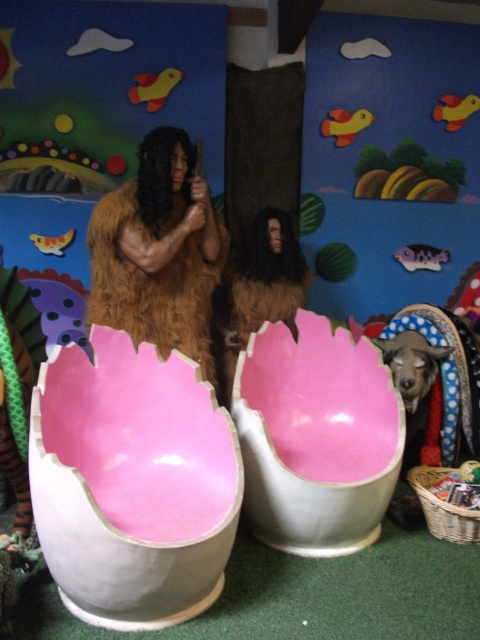
Looking at this image, you are standing in the center of the room and see two points marked on the wall. The first point is at coordinate point (154, 339) and the second point is at coordinate point (437, 353). Which point is closer to you?

Point (154, 339) is in front of point (437, 353), so the first point is closer to you.

You are a visitor at a childrens museum and see the brown furry costume at center and the shiny black dog at lower right. Which one is nearer to you?

The brown furry costume at center is closer to the viewer than the shiny black dog at lower right.

You are a visitor at a childrens museum and see the brown furry costume at center and the shiny black dog at lower right. Which one is bigger?

The brown furry costume at center is larger in size than the shiny black dog at lower right.